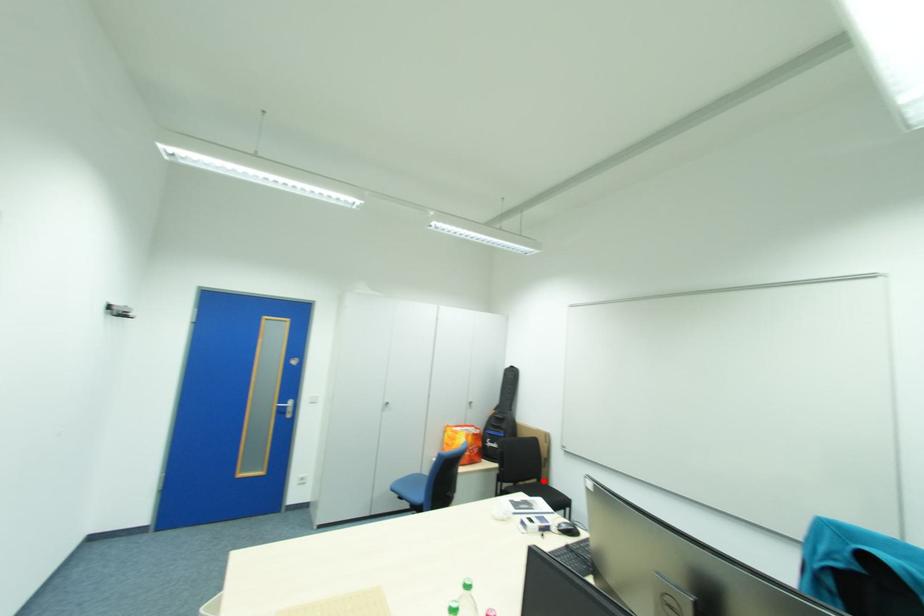
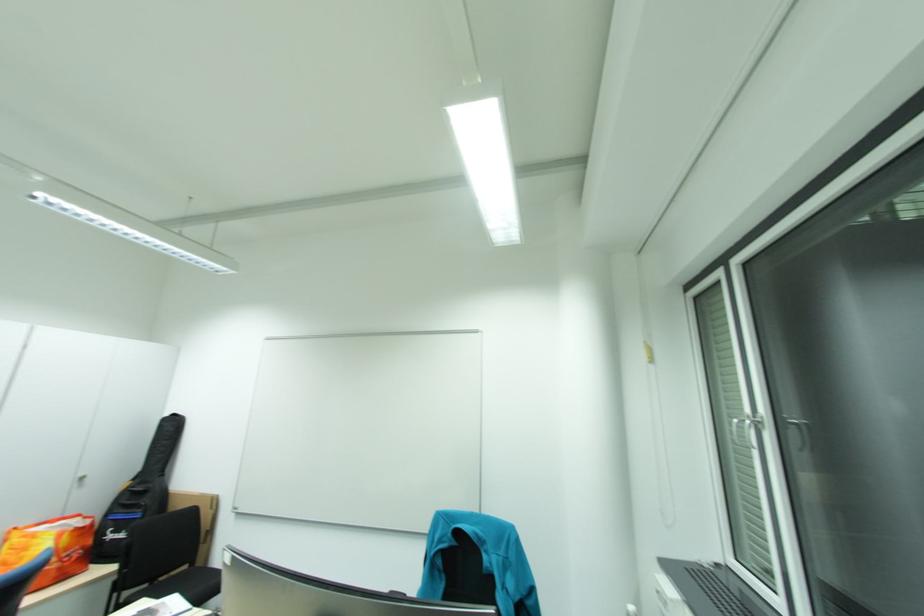
Question: I am providing you with two images of the same scene from different viewpoints. A red point is shown in image1. For the corresponding object point in image2, is it positioned nearer or farther from the camera?

Choices:
 (A) Nearer
 (B) Farther

Answer: (B)